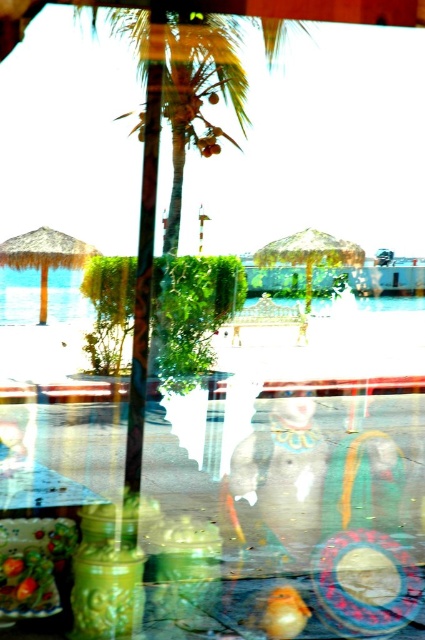
You are a customer in a store looking at the green matte glass jar at center and the shiny brown coconut at center. Which one can you touch first if you reach out your hand?

The green matte glass jar at center is closer to the viewer than the shiny brown coconut at center, so you can touch the green matte glass jar at center first.

You are a customer in a store looking at the green matte glass jar at center and the ripe orange fruit at center. Which item is shorter?

The green matte glass jar at center is shorter than the ripe orange fruit at center.

You are a customer in a store and see the green matte glass jar at center and the shiny brown coconut at center on a display. Which one takes up more space on the shelf?

The green matte glass jar at center is bigger than the shiny brown coconut at center, so it takes up more space on the shelf.